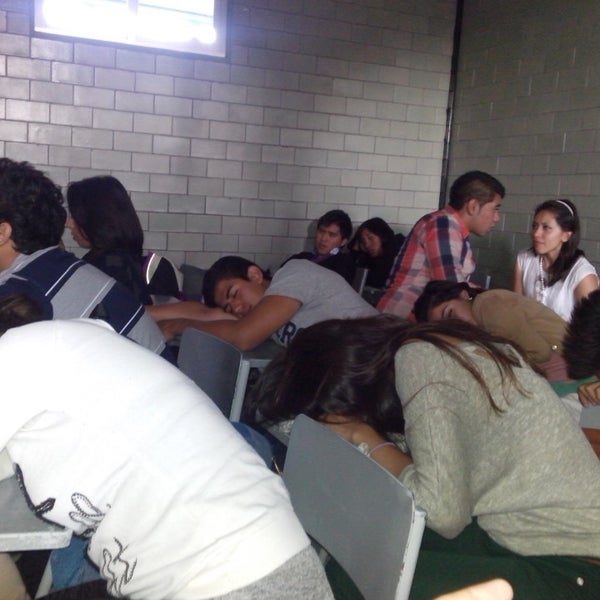
The image size is (600, 600). Find the location of `window`. window is located at coordinates (137, 7).